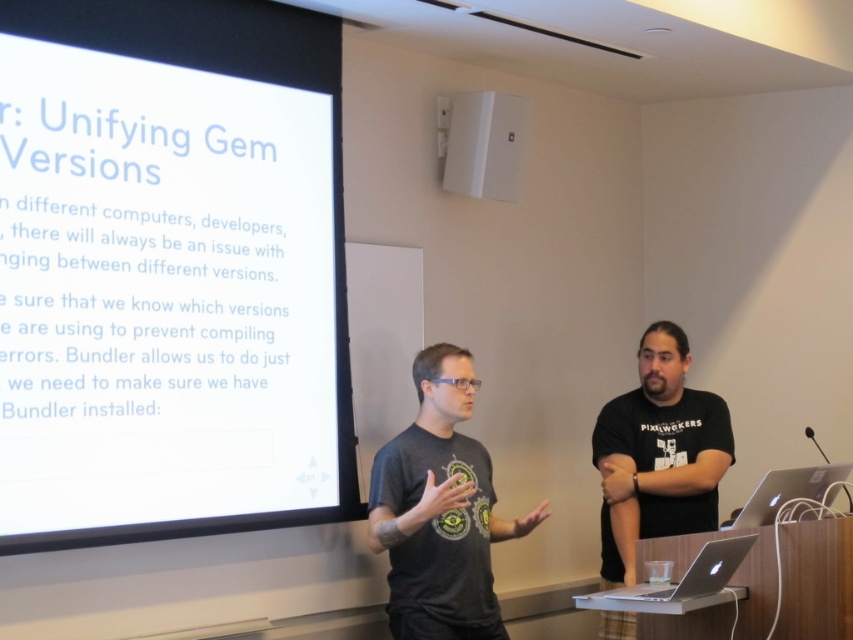
You are a guest attending a tech conference and need to take a photo of the white matte projector screen at upper left. The conference requires photos to be taken from a position where the screen is centered in the frame. Given that the screen is located at point coordinates of 0.425 on the x and 0.200 on the y axis, can you determine if the screen is already centered in the frame?

The white matte projector screen at upper left is located at coordinates 0.425 on the x and 0.200 on the y axis. Since the center of the frame would typically be at coordinates 0.5 on both axes, the screen is slightly to the left and lower than the center point. Therefore, it is not centered in the frame.